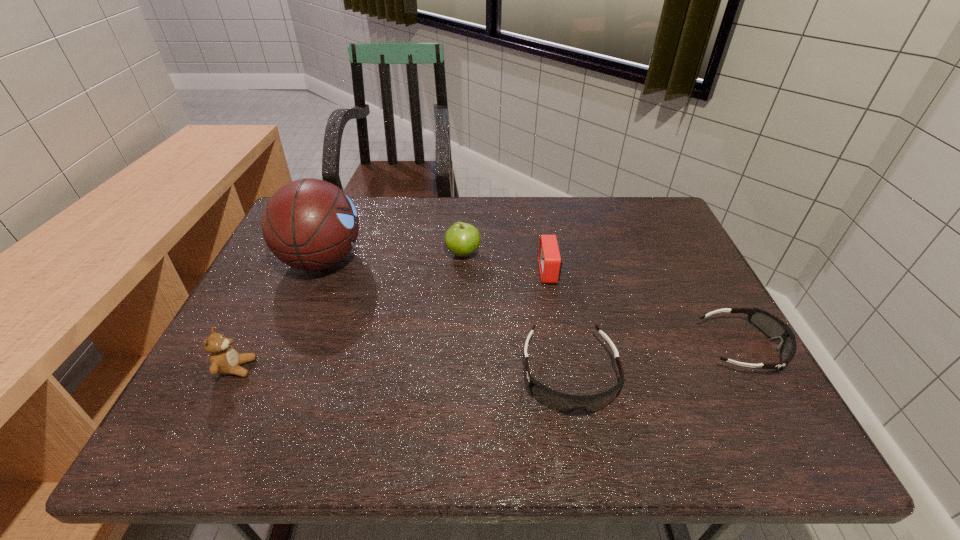
Where is `object located at the near left corner`? Image resolution: width=960 pixels, height=540 pixels. object located at the near left corner is located at coordinates (224, 359).

Identify the location of object located in the near right corner section of the desktop. (773, 327).

In the image, there is a desktop. Where is `free space at the far edge`? free space at the far edge is located at coordinates (552, 207).

This screenshot has height=540, width=960. Find the location of `vacant space at the near edge`. vacant space at the near edge is located at coordinates (420, 383).

This screenshot has width=960, height=540. I want to click on vacant point at the left edge, so click(x=282, y=343).

Where is `vacant space at the right edge of the desktop`? This screenshot has width=960, height=540. vacant space at the right edge of the desktop is located at coordinates (673, 290).

Where is `unoccupied position between the alarm clock and the tallest object`? unoccupied position between the alarm clock and the tallest object is located at coordinates (436, 266).

The width and height of the screenshot is (960, 540). Identify the location of free spot between the tallest object and the taller goggles. (446, 318).

Find the location of a particular element. The image size is (960, 540). free space between the shorter goggles and the fourth object from right to left is located at coordinates (603, 300).

I want to click on free space between the shorter goggles and the tallest object, so click(533, 303).